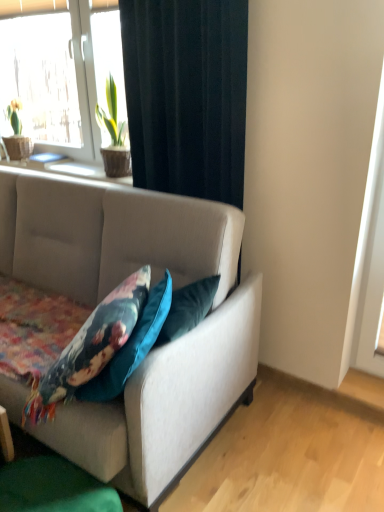
Question: Does textured beige studio couch at center lie behind black fabric curtain at upper center?

Choices:
 (A) no
 (B) yes

Answer: (A)

Question: From a real-world perspective, is textured beige studio couch at center over black fabric curtain at upper center?

Choices:
 (A) no
 (B) yes

Answer: (A)

Question: Could black fabric curtain at upper center be considered to be inside textured beige studio couch at center?

Choices:
 (A) yes
 (B) no

Answer: (B)

Question: Can you confirm if textured beige studio couch at center is wider than black fabric curtain at upper center?

Choices:
 (A) no
 (B) yes

Answer: (B)

Question: Is textured beige studio couch at center oriented towards black fabric curtain at upper center?

Choices:
 (A) no
 (B) yes

Answer: (A)

Question: From the image's perspective, is smooth wooden window sill at upper left located above or below black fabric curtain at upper center?

Choices:
 (A) above
 (B) below

Answer: (A)

Question: Is smooth wooden window sill at upper left to the left or to the right of black fabric curtain at upper center in the image?

Choices:
 (A) right
 (B) left

Answer: (B)

Question: Is point (77, 176) positioned closer to the camera than point (213, 99)?

Choices:
 (A) farther
 (B) closer

Answer: (A)

Question: Is smooth wooden window sill at upper left in front of or behind black fabric curtain at upper center in the image?

Choices:
 (A) front
 (B) behind

Answer: (B)

Question: Based on their sizes in the image, would you say smooth wooden window sill at upper left is bigger or smaller than floral fabric cushion at lower left?

Choices:
 (A) small
 (B) big

Answer: (A)

Question: From a real-world perspective, is smooth wooden window sill at upper left physically located above or below floral fabric cushion at lower left?

Choices:
 (A) below
 (B) above

Answer: (B)

Question: Is smooth wooden window sill at upper left to the left or to the right of floral fabric cushion at lower left in the image?

Choices:
 (A) right
 (B) left

Answer: (B)

Question: Would you say smooth wooden window sill at upper left is inside or outside floral fabric cushion at lower left?

Choices:
 (A) inside
 (B) outside

Answer: (B)

Question: From a real-world perspective, is black fabric curtain at upper center above or below white plastic window at upper left?

Choices:
 (A) above
 (B) below

Answer: (B)

Question: Does point (137, 37) appear closer or farther from the camera than point (115, 24)?

Choices:
 (A) farther
 (B) closer

Answer: (B)